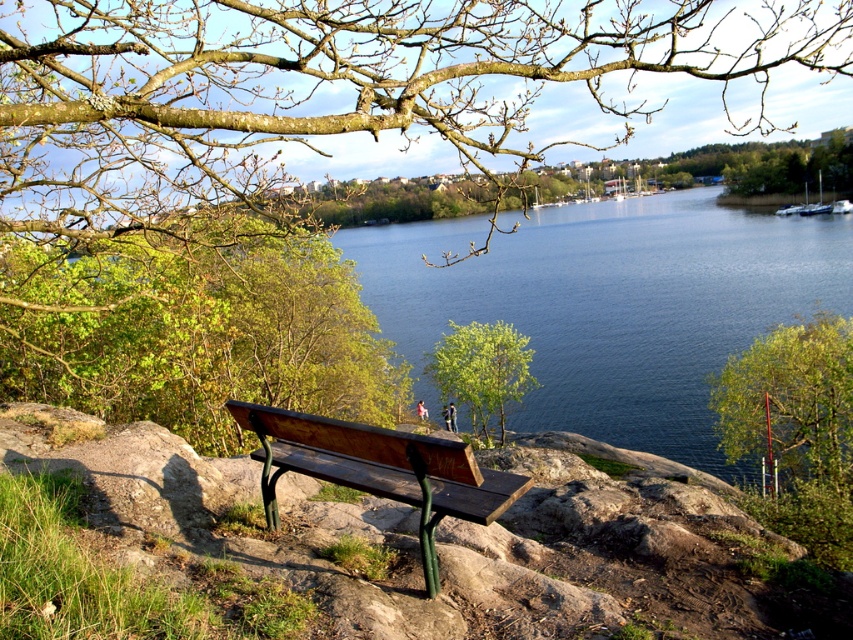
What do you see at coordinates (379, 468) in the screenshot?
I see `wooden bench at center` at bounding box center [379, 468].

Does wooden bench at center have a smaller size compared to green leafy tree at lower right?

Yes.

Is point (506, 488) less distant than point (831, 440)?

Yes.

The height and width of the screenshot is (640, 853). Identify the location of wooden bench at center. (379, 468).

The width and height of the screenshot is (853, 640). I want to click on green leafy tree at left, so click(x=193, y=330).

Measure the distance between point (358, 413) and camera.

Point (358, 413) is 21.39 meters from camera.

Who is more forward, [6,324] or [479,368]?

Point [6,324]

Identify the location of green leafy tree at left. Image resolution: width=853 pixels, height=640 pixels. click(x=193, y=330).

Which is more to the right, green leafy tree at lower right or green leafy tree at center?

green leafy tree at lower right is more to the right.

Between green leafy tree at lower right and green leafy tree at center, which one is positioned higher?

green leafy tree at center

Where is `green leafy tree at lower right`? The height and width of the screenshot is (640, 853). green leafy tree at lower right is located at coordinates (791, 401).

Find the location of a particular element. The width and height of the screenshot is (853, 640). green leafy tree at lower right is located at coordinates (791, 401).